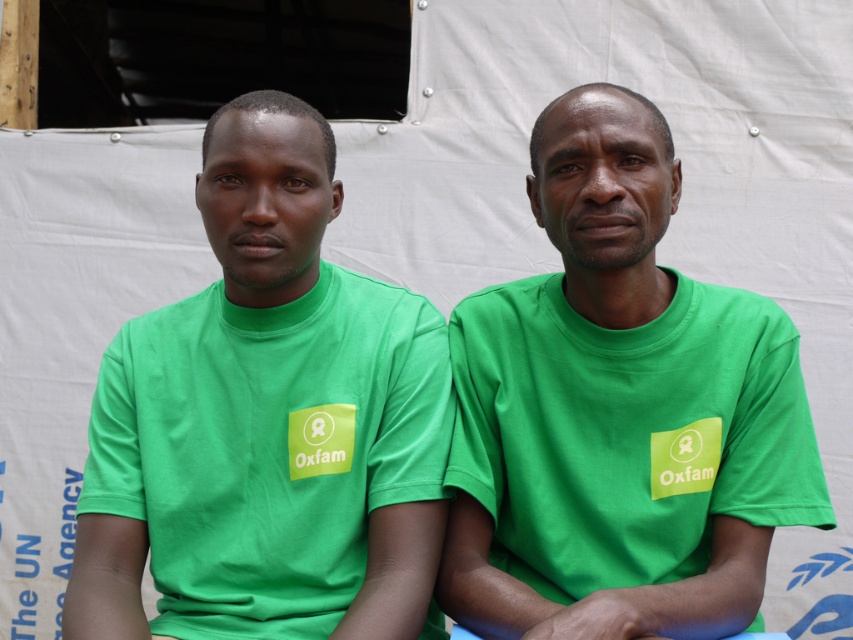
You are a photographer setting up for a group photo. You notice a point at coordinates (619, 412) in the image. Based on the scene description, what object does this point correspond to?

The point at coordinates (619, 412) corresponds to the green matte t shirt at center.